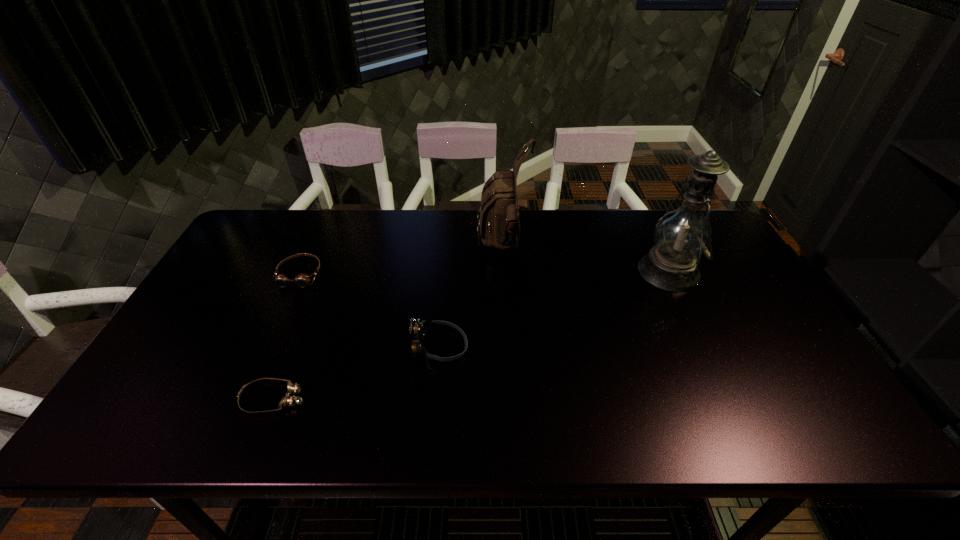
The image size is (960, 540). Identify the location of free space located 0.330m on the left of the oil lamp. (530, 271).

Locate an element on the screen. free space located 0.090m on the front-facing side of the second object from right to left is located at coordinates (449, 247).

Identify the location of free spot located on the front-facing side of the second object from right to left. The height and width of the screenshot is (540, 960). (437, 247).

Locate an element on the screen. Image resolution: width=960 pixels, height=540 pixels. vacant space located on the front-facing side of the second object from right to left is located at coordinates (462, 247).

Locate an element on the screen. vacant space positioned through the lenses of the rightmost goggles is located at coordinates coord(539,347).

Find the location of a particular element. vacant space situated through the lenses of the second tallest goggles is located at coordinates (240, 404).

What are the coordinates of `vacant region located 0.170m on the front lenses and sides of the shortest object` in the screenshot? It's located at (381, 398).

This screenshot has width=960, height=540. Identify the location of oil lamp at the far edge. (681, 236).

This screenshot has height=540, width=960. Find the location of `shoulder bag at the far edge`. shoulder bag at the far edge is located at coordinates (498, 221).

Locate an element on the screen. Image resolution: width=960 pixels, height=540 pixels. object located at the near edge is located at coordinates click(288, 400).